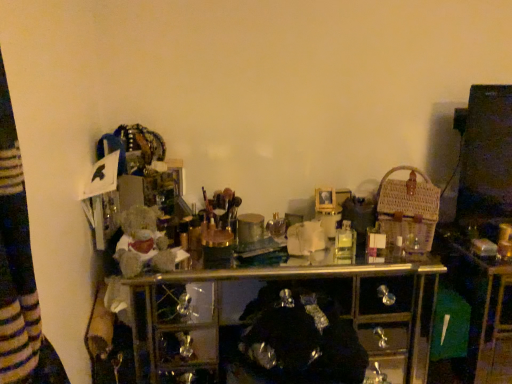
Question: Considering the positions of woven brown basket at right and clear plastic bottle at center in the image, is woven brown basket at right taller or shorter than clear plastic bottle at center?

Choices:
 (A) short
 (B) tall

Answer: (A)

Question: Looking at their shapes, would you say woven brown basket at right is wider or thinner than clear plastic bottle at center?

Choices:
 (A) thin
 (B) wide

Answer: (A)

Question: From a real-world perspective, is woven brown basket at right above or below clear plastic bottle at center?

Choices:
 (A) below
 (B) above

Answer: (B)

Question: Considering the positions of clear plastic bottle at center and woven brown basket at right in the image, is clear plastic bottle at center wider or thinner than woven brown basket at right?

Choices:
 (A) wide
 (B) thin

Answer: (A)

Question: From the image's perspective, is clear plastic bottle at center located above or below woven brown basket at right?

Choices:
 (A) below
 (B) above

Answer: (A)

Question: Is clear plastic bottle at center inside or outside of woven brown basket at right?

Choices:
 (A) inside
 (B) outside

Answer: (B)

Question: Is point (460, 233) closer or farther from the camera than point (387, 185)?

Choices:
 (A) closer
 (B) farther

Answer: (B)